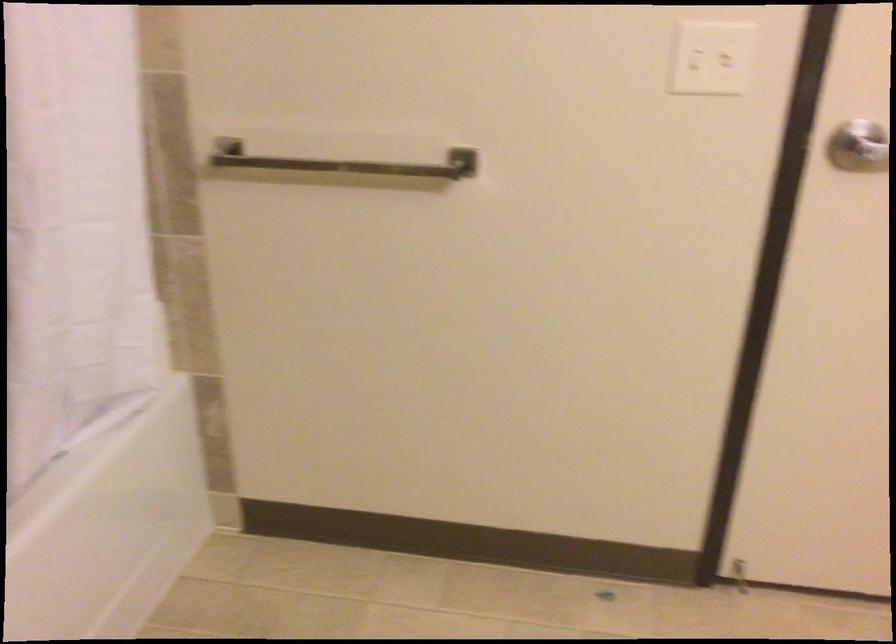
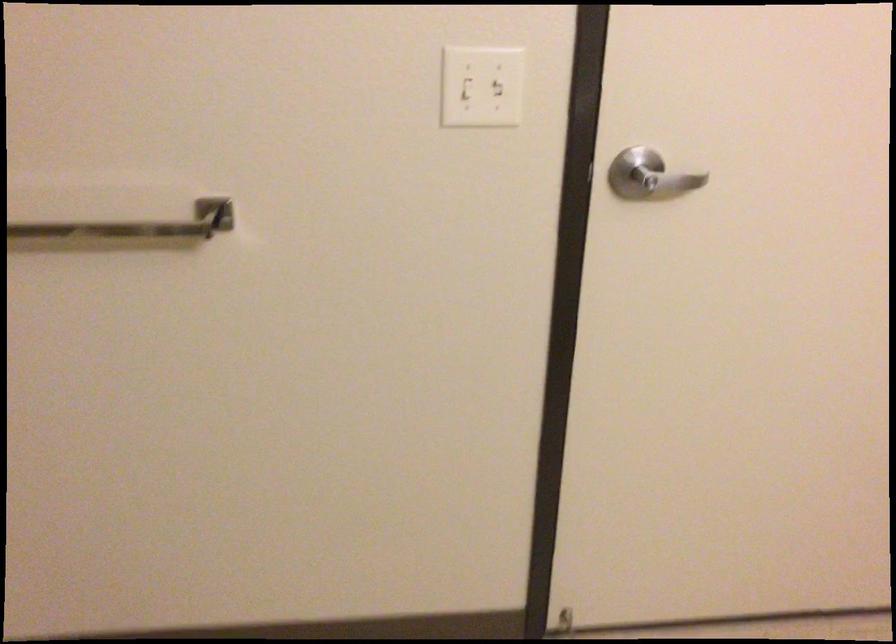
Locate, in the second image, the point that corresponds to the point at 386,163 in the first image.

(125, 219)